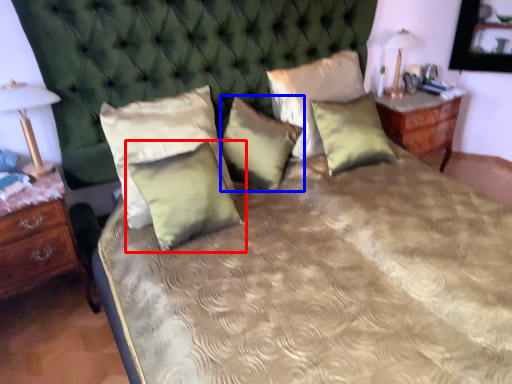
Question: Among these objects, which one is farthest to the camera, pillow (highlighted by a red box) or pillow (highlighted by a blue box)?

Choices:
 (A) pillow
 (B) pillow

Answer: (B)